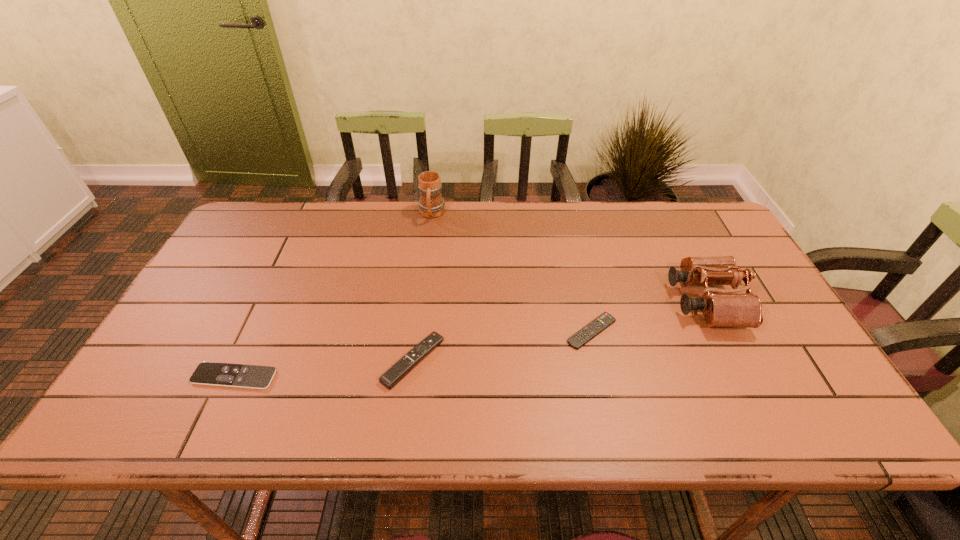
The image size is (960, 540). Identify the location of free space between the rightmost object and the tallest remote control. (560, 331).

This screenshot has width=960, height=540. In order to click on free space between the binoculars and the fourth object from left to right in this screenshot , I will do `click(649, 316)`.

The height and width of the screenshot is (540, 960). I want to click on object that stands as the fourth closest to the rightmost object, so click(x=207, y=373).

Find the location of a particular element. Image resolution: width=960 pixels, height=540 pixels. object that is the third nearest to the third shortest object is located at coordinates (431, 204).

At what (x,y) coordinates should I click in order to perform the action: click on the second closest remote control relative to the third shortest object. Please return your answer as a coordinate pair (x, y). Looking at the image, I should click on (580, 338).

Point out which remote control is positioned as the second nearest to the leftmost remote control. Please provide its 2D coordinates. Your answer should be formatted as a tuple, i.e. [(x, y)], where the tuple contains the x and y coordinates of a point satisfying the conditions above.

[(580, 338)]

This screenshot has height=540, width=960. Find the location of `free space that satisfies the following two spatial constraints: 1. on the side of the rightmost remote control with the handle; 2. on the right side of the farthest object`. free space that satisfies the following two spatial constraints: 1. on the side of the rightmost remote control with the handle; 2. on the right side of the farthest object is located at coordinates click(x=417, y=331).

Where is `blank space that satisfies the following two spatial constraints: 1. on the side of the mug with the handle; 2. on the right side of the rightmost remote control`? The width and height of the screenshot is (960, 540). blank space that satisfies the following two spatial constraints: 1. on the side of the mug with the handle; 2. on the right side of the rightmost remote control is located at coordinates (417, 331).